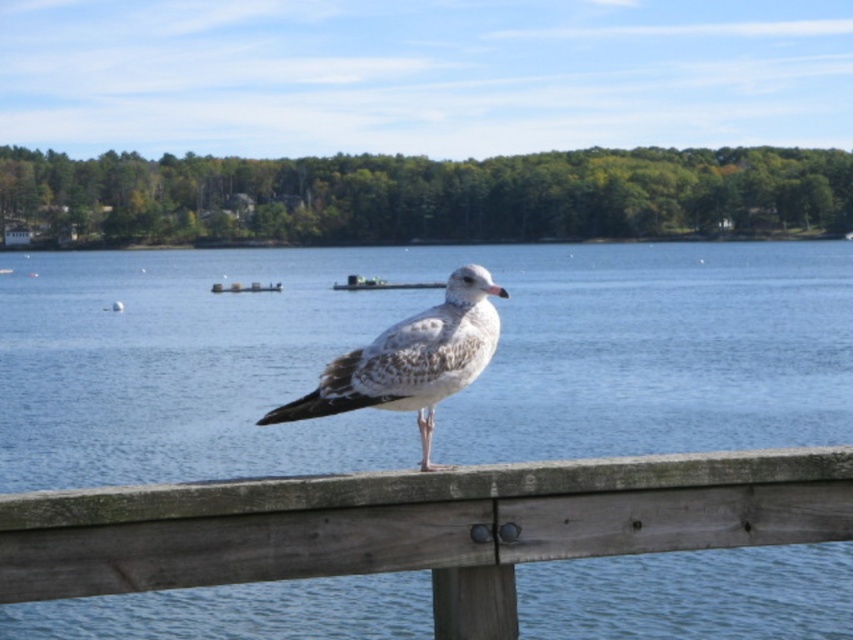
From the picture: You are standing at the edge of the lake and want to locate the blue water at center. According to the coordinates provided, where exactly should you look?

The blue water at center is located at the coordinates point (392, 323).

You are a birdhouse builder assessing the space between the weathered wood rail at center and the speckled feathered seagull at center. If the seagull needs a 10 cm gap to fly through, can it pass through the space between them?

The weathered wood rail at center might be wider than the speckled feathered seagull at center, so there might not be enough space for the seagull to pass through the gap if it requires 10 cm. Further measurement is needed.

You are standing on the weathered wood rail at center and want to jump into the blue water at center. Based on the scene, will your jump reach the water?

The blue water at center is taller than the weathered wood rail at center, so jumping from the rail will reach the water.